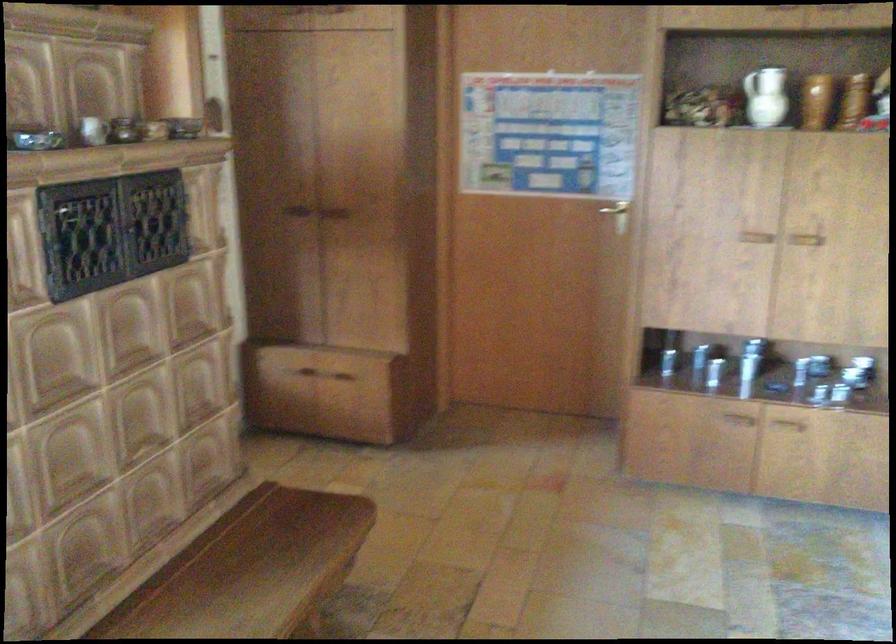
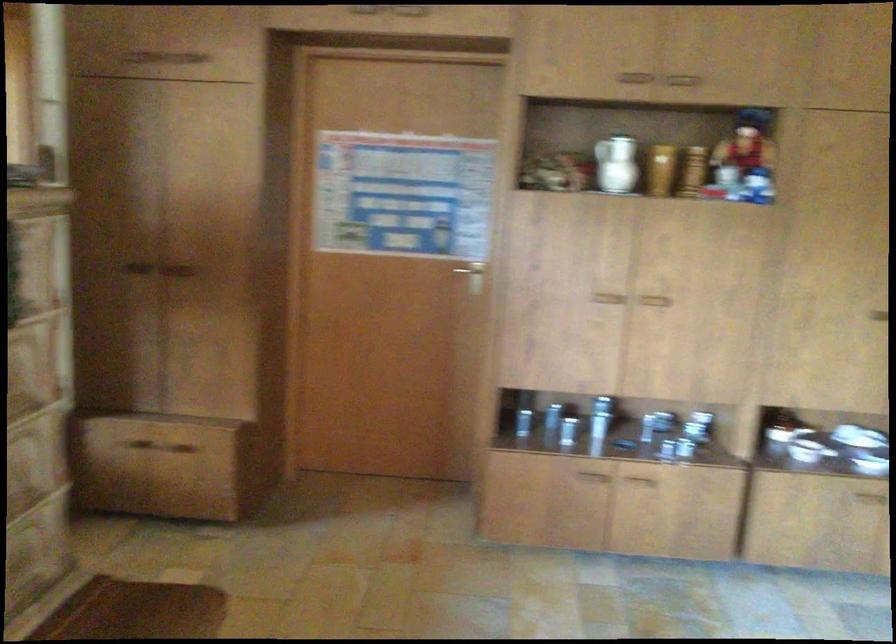
Find the pixel in the second image that matches (780,232) in the first image.

(633, 295)